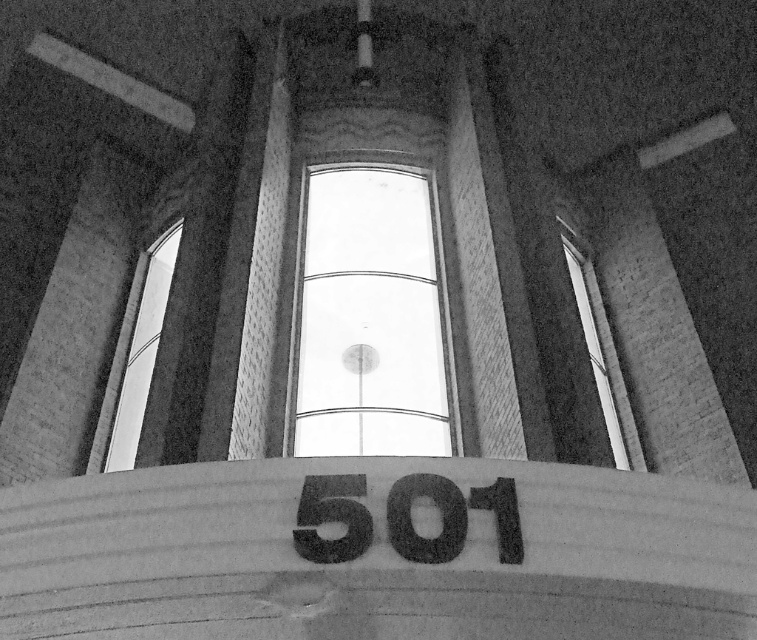
Is transparent glass window at center bigger than transparent glass window at left?

Indeed, transparent glass window at center has a larger size compared to transparent glass window at left.

Can you confirm if transparent glass window at center is wider than transparent glass window at left?

Yes, transparent glass window at center is wider than transparent glass window at left.

At what (x,y) coordinates should I click in order to perform the action: click on transparent glass window at center. Please return your answer as a coordinate pair (x, y). The width and height of the screenshot is (757, 640). Looking at the image, I should click on (369, 317).

The image size is (757, 640). Find the location of `transparent glass window at center`. transparent glass window at center is located at coordinates (369, 317).

Between transparent glass window at center and transparent glass window at upper center, which one is positioned higher?

transparent glass window at center is above.

Does transparent glass window at center have a lesser height compared to transparent glass window at upper center?

Incorrect, transparent glass window at center's height does not fall short of transparent glass window at upper center's.

Where is `transparent glass window at center`? transparent glass window at center is located at coordinates (369, 317).

Can you confirm if transparent glass window at left is taller than transparent glass window at upper center?

Incorrect, transparent glass window at left's height is not larger of transparent glass window at upper center's.

Is point (114, 392) in front of point (637, 468)?

That is False.

Image resolution: width=757 pixels, height=640 pixels. Describe the element at coordinates (139, 355) in the screenshot. I see `transparent glass window at left` at that location.

The width and height of the screenshot is (757, 640). Find the location of `transparent glass window at left`. transparent glass window at left is located at coordinates pos(139,355).